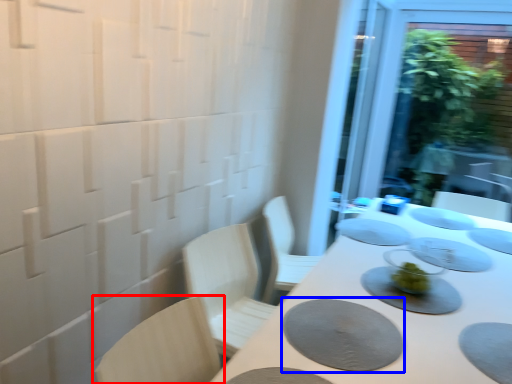
Question: Which object appears closest to the camera in this image, chair (highlighted by a red box) or platter (highlighted by a blue box)?

Choices:
 (A) chair
 (B) platter

Answer: (A)